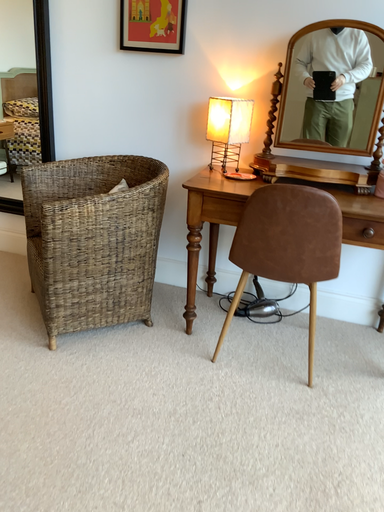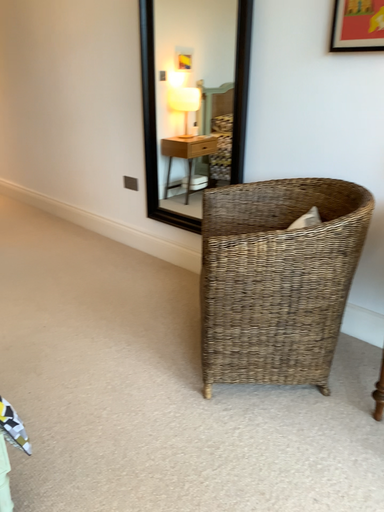
Question: How did the camera likely rotate when shooting the video?

Choices:
 (A) rotated right
 (B) rotated left

Answer: (B)